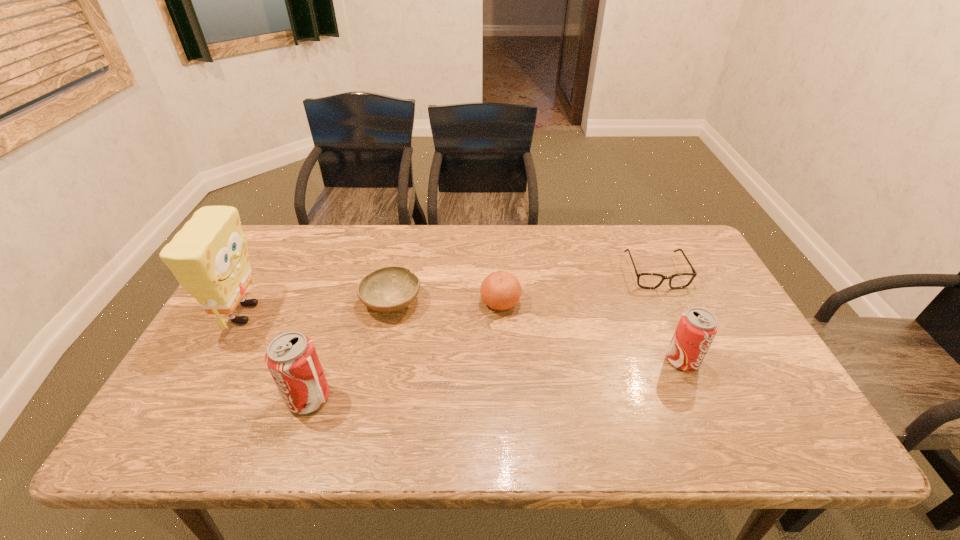
The width and height of the screenshot is (960, 540). I want to click on free point between the third tallest object and the fourth object from right to left, so (x=537, y=331).

Identify the location of unoccupied position between the nearest object and the third tallest object. (495, 379).

You are a GUI agent. You are given a task and a screenshot of the screen. Output one action in this format:
    pyautogui.click(x=<x>, y=<y>)
    Task: Click on the free spot between the bowl and the fifth shortest object
    
    Given the screenshot: What is the action you would take?
    pyautogui.click(x=350, y=350)

I want to click on vacant space in between the spectacles and the fifth farthest object, so click(x=669, y=316).

Where is `free area in between the spectacles and the fourth object from left to right`? This screenshot has width=960, height=540. free area in between the spectacles and the fourth object from left to right is located at coordinates (578, 288).

Find the location of a particular element. This screenshot has width=960, height=540. unoccupied area between the fourth shortest object and the spectacles is located at coordinates (669, 316).

Select which object appears as the fourth closest to the spectacles. Please provide its 2D coordinates. Your answer should be formatted as a tuple, i.e. [(x, y)], where the tuple contains the x and y coordinates of a point satisfying the conditions above.

[(291, 358)]

The image size is (960, 540). In order to click on the fourth closest object relative to the nearest object in this screenshot , I will do `click(697, 328)`.

Where is `free spot that satisfies the following two spatial constraints: 1. on the front-facing side of the spectacles; 2. on the face of the leftmost object`? The height and width of the screenshot is (540, 960). free spot that satisfies the following two spatial constraints: 1. on the front-facing side of the spectacles; 2. on the face of the leftmost object is located at coordinates (674, 314).

The width and height of the screenshot is (960, 540). What are the coordinates of `free space that satisfies the following two spatial constraints: 1. on the front-facing side of the spectacles; 2. on the face of the leftmost object` in the screenshot? It's located at (674, 314).